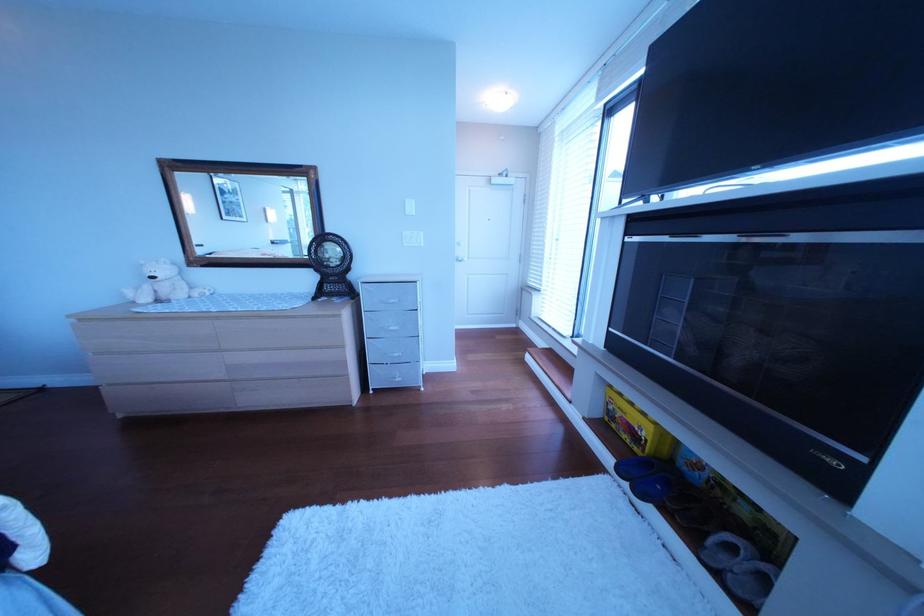
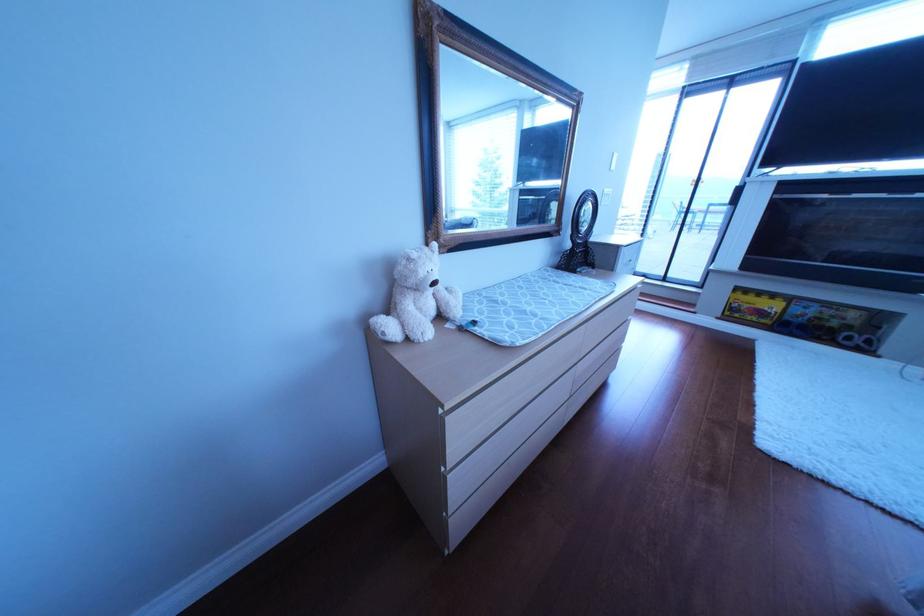
The point at (365,275) is marked in the first image. Where is the corresponding point in the second image?

(605, 240)